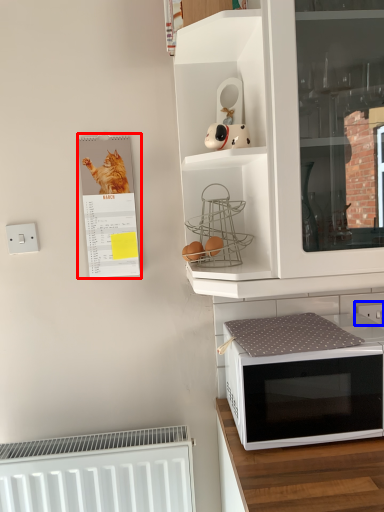
Question: Which object is closer to the camera taking this photo, bulletin board (highlighted by a red box) or electric outlet (highlighted by a blue box)?

Choices:
 (A) bulletin board
 (B) electric outlet

Answer: (A)